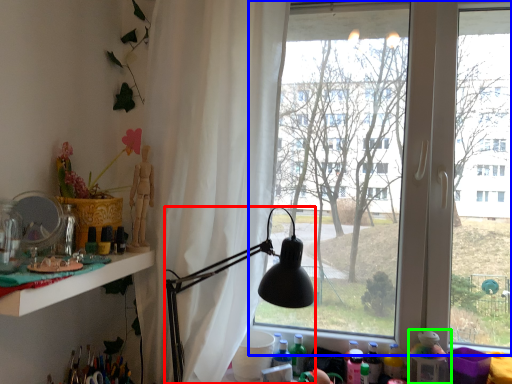
Question: Which is nearer to the lamp (highlighted by a red box)? window (highlighted by a blue box) or toy (highlighted by a green box).

Choices:
 (A) window
 (B) toy

Answer: (A)